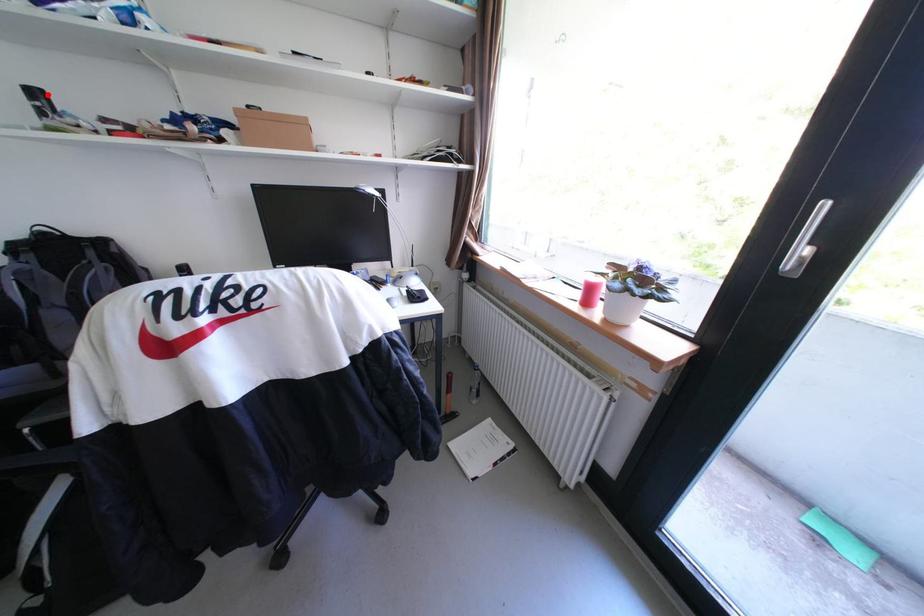
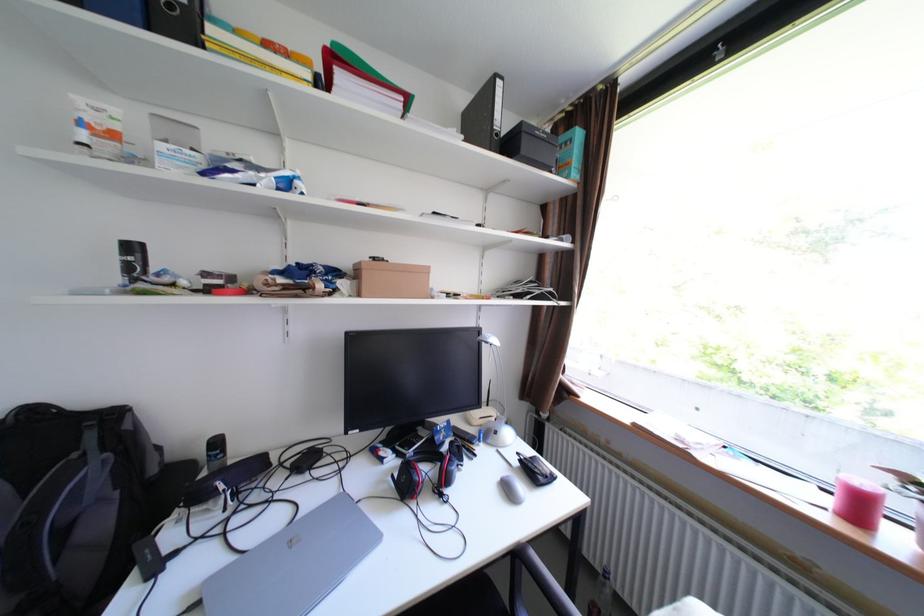
Where in the second image is the point corresponding to the highlighted location from the first image?

(143, 248)